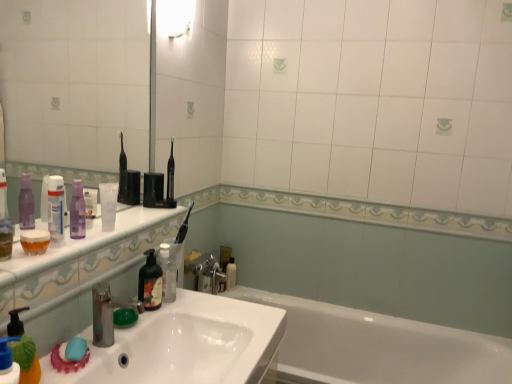
Locate an element on the screen. This screenshot has height=384, width=512. free point above white glossy countertop at upper left (from a real-world perspective) is located at coordinates (104, 226).